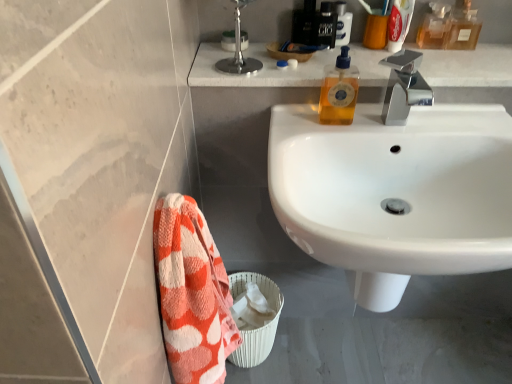
Locate an element on the screen. This screenshot has height=384, width=512. free space between white plastic toothpaste tube at upper right, marked as the 2th mouthwash in a left-to-right arrangement, and transparent glass bottle at upper right, acting as the fourth mouthwash starting from the left is located at coordinates (426, 48).